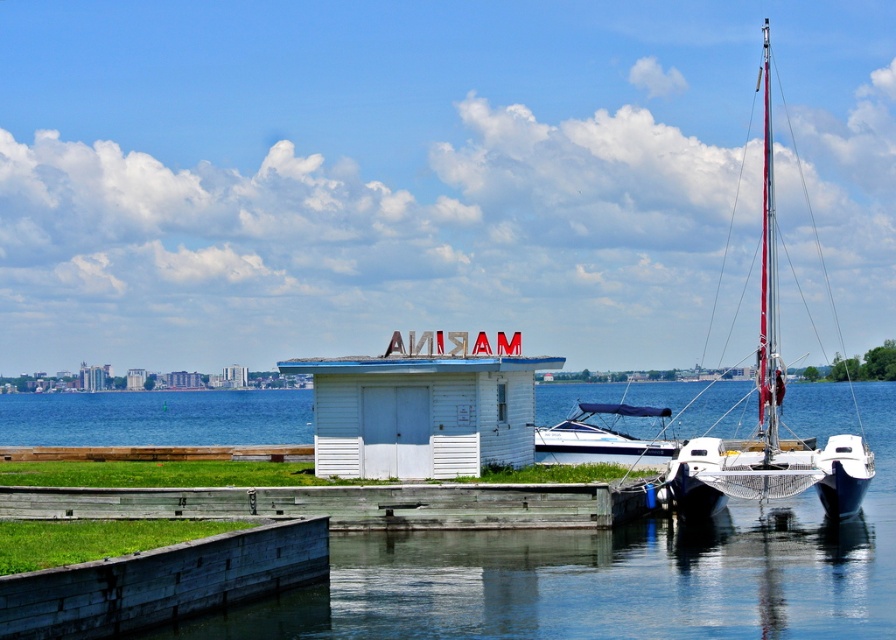
Is wooden dock at lower center below metallic silver sailboat at right?

Correct, wooden dock at lower center is located below metallic silver sailboat at right.

Is point (472, 502) positioned behind point (774, 448)?

No, it is in front of (774, 448).

Measure the distance between wooden dock at lower center and camera.

They are 67.90 feet apart.

Where is `wooden dock at lower center`? wooden dock at lower center is located at coordinates (345, 504).

Between metallic silver sailboat at right and blue water at lower left, which one has less height?

Standing shorter between the two is blue water at lower left.

Does point (767, 289) come behind point (201, 432)?

No, (767, 289) is in front of (201, 432).

Is point (705, 486) more distant than point (168, 432)?

No, it is not.

You are a GUI agent. You are given a task and a screenshot of the screen. Output one action in this format:
    pyautogui.click(x=<x>, y=<y>)
    Task: Click on the metallic silver sailboat at right
    
    Given the screenshot: What is the action you would take?
    pyautogui.click(x=767, y=406)

Looking at this image, between metallic silver sailboat at right and white plastic boat at center, which one is positioned lower?

white plastic boat at center

Describe the element at coordinates (767, 406) in the screenshot. I see `metallic silver sailboat at right` at that location.

Describe the element at coordinates (767, 406) in the screenshot. The width and height of the screenshot is (896, 640). I see `metallic silver sailboat at right` at that location.

At what (x,y) coordinates should I click in order to perform the action: click on metallic silver sailboat at right. Please return your answer as a coordinate pair (x, y). Image resolution: width=896 pixels, height=640 pixels. Looking at the image, I should click on (767, 406).